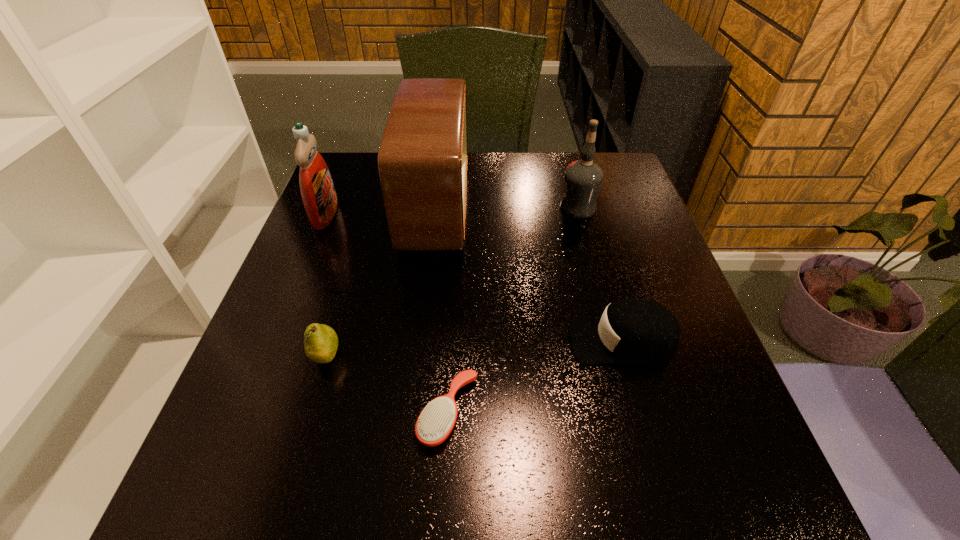
At what (x,y) coordinates should I click in order to perform the action: click on free spot between the second object from left to right and the leftmost object. Please return your answer as a coordinate pair (x, y). Looking at the image, I should click on (325, 286).

I want to click on vacant area that lies between the detergent and the radio receiver, so click(380, 212).

You are a GUI agent. You are given a task and a screenshot of the screen. Output one action in this format:
    pyautogui.click(x=<x>, y=<y>)
    Task: Click on the vacant area that lies between the shortest object and the detergent
    This screenshot has width=960, height=540.
    Given the screenshot: What is the action you would take?
    pyautogui.click(x=387, y=313)

I want to click on free spot between the detergent and the shortest object, so click(387, 313).

The height and width of the screenshot is (540, 960). In order to click on free space between the leftmost object and the second object from left to right in this screenshot , I will do `click(325, 286)`.

You are a GUI agent. You are given a task and a screenshot of the screen. Output one action in this format:
    pyautogui.click(x=<x>, y=<y>)
    Task: Click on the empty location between the second shortest object and the radio receiver
    
    Given the screenshot: What is the action you would take?
    pyautogui.click(x=529, y=275)

This screenshot has width=960, height=540. What are the coordinates of `free space between the radio receiver and the fifth object from right to left` in the screenshot? It's located at (381, 283).

Locate an element on the screen. The width and height of the screenshot is (960, 540). free space between the leftmost object and the second object from left to right is located at coordinates (325, 286).

Where is `vacant space that is in between the fifth object from right to left and the nearest object`? vacant space that is in between the fifth object from right to left and the nearest object is located at coordinates (387, 385).

This screenshot has height=540, width=960. Find the location of `object that ranks as the fourth closest to the detergent`. object that ranks as the fourth closest to the detergent is located at coordinates (583, 178).